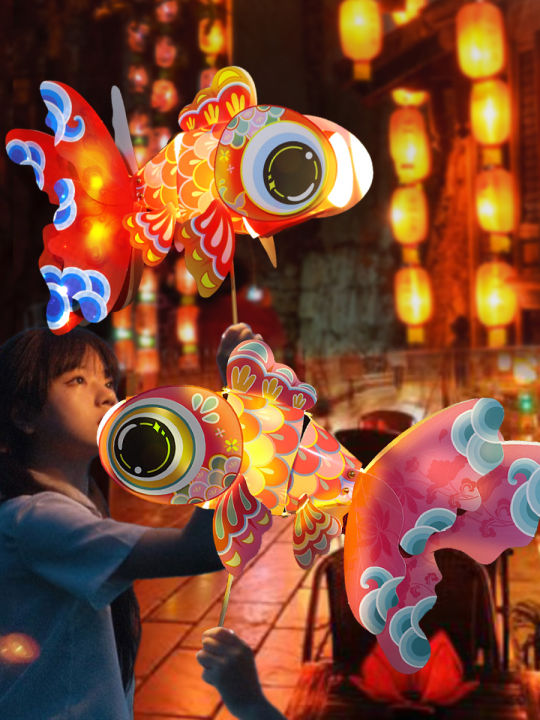
Find the location of `floor`. floor is located at coordinates (272, 585).